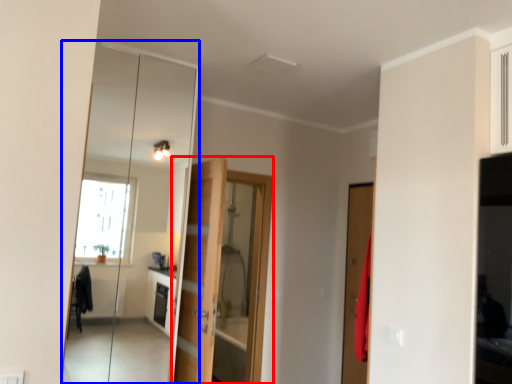
Question: Which object is closer to the camera taking this photo, door (highlighted by a red box) or mirror (highlighted by a blue box)?

Choices:
 (A) door
 (B) mirror

Answer: (B)